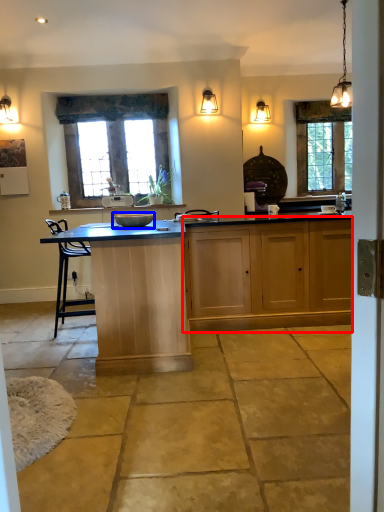
Question: Which object appears closest to the camera in this image, cabinetry (highlighted by a red box) or appliance (highlighted by a blue box)?

Choices:
 (A) cabinetry
 (B) appliance

Answer: (B)